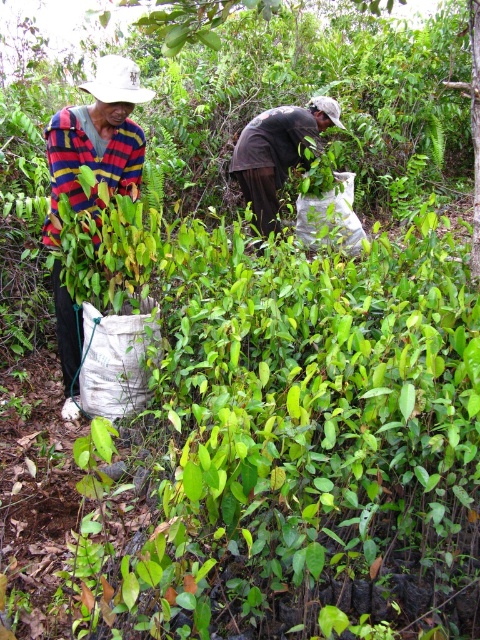
Question: Can you confirm if striped fabric shirt at left is positioned above brown fabric bag at center?

Choices:
 (A) no
 (B) yes

Answer: (A)

Question: Does striped fabric shirt at left lie in front of brown fabric bag at center?

Choices:
 (A) yes
 (B) no

Answer: (A)

Question: Which object appears closest to the camera in this image?

Choices:
 (A) brown fabric bag at center
 (B) striped fabric shirt at left

Answer: (B)

Question: Which of the following is the closest to the observer?

Choices:
 (A) brown fabric bag at center
 (B) striped fabric shirt at left

Answer: (B)

Question: Can you confirm if striped fabric shirt at left is bigger than brown fabric bag at center?

Choices:
 (A) yes
 (B) no

Answer: (A)